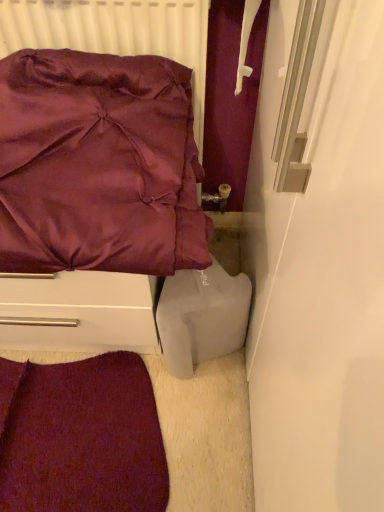
Question: Can we say white matte plastic container at lower right lies outside matte white radiator at upper left?

Choices:
 (A) no
 (B) yes

Answer: (B)

Question: Is white matte plastic container at lower right aimed at matte white radiator at upper left?

Choices:
 (A) yes
 (B) no

Answer: (B)

Question: Are white matte plastic container at lower right and matte white radiator at upper left making contact?

Choices:
 (A) yes
 (B) no

Answer: (B)

Question: Would you say white matte plastic container at lower right is a long distance from matte white radiator at upper left?

Choices:
 (A) yes
 (B) no

Answer: (B)

Question: From a real-world perspective, is white matte plastic container at lower right below matte white radiator at upper left?

Choices:
 (A) no
 (B) yes

Answer: (B)

Question: Is matte white radiator at upper left in front of or behind satin purple pillow at upper left in the image?

Choices:
 (A) front
 (B) behind

Answer: (B)

Question: From the image's perspective, is matte white radiator at upper left positioned above or below satin purple pillow at upper left?

Choices:
 (A) above
 (B) below

Answer: (A)

Question: Considering the positions of point (66, 7) and point (74, 304), is point (66, 7) closer or farther from the camera than point (74, 304)?

Choices:
 (A) farther
 (B) closer

Answer: (B)

Question: Looking at the image, does matte white radiator at upper left seem bigger or smaller compared to satin purple pillow at upper left?

Choices:
 (A) small
 (B) big

Answer: (A)

Question: From a real-world perspective, is velvet carpet at lower left positioned above or below matte white radiator at upper left?

Choices:
 (A) above
 (B) below

Answer: (B)

Question: In the image, is velvet carpet at lower left on the left side or the right side of matte white radiator at upper left?

Choices:
 (A) left
 (B) right

Answer: (A)

Question: In terms of size, does velvet carpet at lower left appear bigger or smaller than matte white radiator at upper left?

Choices:
 (A) small
 (B) big

Answer: (A)

Question: Is velvet carpet at lower left spatially inside matte white radiator at upper left, or outside of it?

Choices:
 (A) outside
 (B) inside

Answer: (A)

Question: In terms of height, does matte white radiator at upper left look taller or shorter compared to velvet carpet at lower left?

Choices:
 (A) tall
 (B) short

Answer: (A)

Question: Is matte white radiator at upper left spatially inside velvet carpet at lower left, or outside of it?

Choices:
 (A) inside
 (B) outside

Answer: (B)